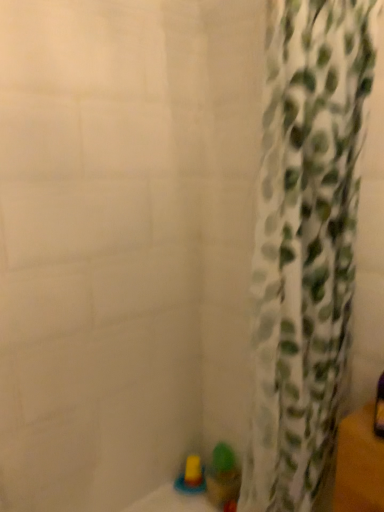
This screenshot has height=512, width=384. Identify the location of translucent yellow toy at lower center, the 2th toy from the right. (191, 477).

You are a GUI agent. You are given a task and a screenshot of the screen. Output one action in this format:
    pyautogui.click(x=<x>, y=<y>)
    Task: Click on the white fabric curtain at right
    
    Given the screenshot: What is the action you would take?
    pyautogui.click(x=305, y=246)

Locate an element on the screen. This screenshot has height=512, width=384. translucent yellow toy at lower center, the 2th toy from the right is located at coordinates (191, 477).

Considering the positions of objects white fabric curtain at right and translucent yellow toy at lower center, which is counted as the 1th toy, starting from the left, in the image provided, who is more to the right, white fabric curtain at right or translucent yellow toy at lower center, which is counted as the 1th toy, starting from the left,?

From the viewer's perspective, white fabric curtain at right appears more on the right side.

Is translucent yellow toy at lower center, the 2th toy from the right, inside white fabric curtain at right?

Actually, translucent yellow toy at lower center, the 2th toy from the right, is outside white fabric curtain at right.

From the image's perspective, which object appears higher, white fabric curtain at right or translucent yellow toy at lower center, which is counted as the 1th toy, starting from the left?

white fabric curtain at right, from the image's perspective.

Based on the photo, is translucent yellow toy at lower center, which is counted as the 1th toy, starting from the left, completely or partially outside of translucent plastic cup at lower center, arranged as the first toy when viewed from the right?

translucent yellow toy at lower center, which is counted as the 1th toy, starting from the left, is positioned outside translucent plastic cup at lower center, arranged as the first toy when viewed from the right.

Would you consider translucent yellow toy at lower center, the 2th toy from the right, to be distant from translucent plastic cup at lower center, arranged as the first toy when viewed from the right?

No, translucent yellow toy at lower center, the 2th toy from the right, is in close proximity to translucent plastic cup at lower center, arranged as the first toy when viewed from the right.

From their relative heights in the image, would you say translucent yellow toy at lower center, which is counted as the 1th toy, starting from the left, is taller or shorter than translucent plastic cup at lower center, arranged as the first toy when viewed from the right?

In the image, translucent yellow toy at lower center, which is counted as the 1th toy, starting from the left, appears to be shorter than translucent plastic cup at lower center, arranged as the first toy when viewed from the right.

Between translucent yellow toy at lower center, the 2th toy from the right, and translucent plastic cup at lower center, the second toy viewed from the left, which one has larger width?

translucent yellow toy at lower center, the 2th toy from the right, is wider.

Is translucent yellow toy at lower center, the 2th toy from the right, smaller than white fabric curtain at right?

Yes.

How many degrees apart are the facing directions of translucent yellow toy at lower center, the 2th toy from the right, and white fabric curtain at right?

There is a 42.5-degree angle between the facing directions of translucent yellow toy at lower center, the 2th toy from the right, and white fabric curtain at right.

Can you confirm if translucent yellow toy at lower center, which is counted as the 1th toy, starting from the left, is taller than white fabric curtain at right?

In fact, translucent yellow toy at lower center, which is counted as the 1th toy, starting from the left, may be shorter than white fabric curtain at right.

Where is `curtain located on the right of translucent yellow toy at lower center, which is counted as the 1th toy, starting from the left`? curtain located on the right of translucent yellow toy at lower center, which is counted as the 1th toy, starting from the left is located at coordinates (305, 246).

Does translucent plastic cup at lower center, arranged as the first toy when viewed from the right, have a smaller size compared to translucent yellow toy at lower center, which is counted as the 1th toy, starting from the left?

Actually, translucent plastic cup at lower center, arranged as the first toy when viewed from the right, might be larger than translucent yellow toy at lower center, which is counted as the 1th toy, starting from the left.

Considering the positions of objects translucent plastic cup at lower center, arranged as the first toy when viewed from the right, and translucent yellow toy at lower center, which is counted as the 1th toy, starting from the left, in the image provided, who is behind, translucent plastic cup at lower center, arranged as the first toy when viewed from the right, or translucent yellow toy at lower center, which is counted as the 1th toy, starting from the left,?

translucent yellow toy at lower center, which is counted as the 1th toy, starting from the left, is further away from the camera.

Is there a large distance between translucent plastic cup at lower center, the second toy viewed from the left, and translucent yellow toy at lower center, the 2th toy from the right?

translucent plastic cup at lower center, the second toy viewed from the left, is near translucent yellow toy at lower center, the 2th toy from the right, not far away.

Does translucent plastic cup at lower center, the second toy viewed from the left, contain translucent yellow toy at lower center, the 2th toy from the right?

Definitely not — translucent yellow toy at lower center, the 2th toy from the right, is not inside translucent plastic cup at lower center, the second toy viewed from the left.

Is translucent plastic cup at lower center, arranged as the first toy when viewed from the right, further to the viewer compared to white fabric curtain at right?

That is True.

Considering the positions of point (234, 475) and point (332, 101), is point (234, 475) closer or farther from the camera than point (332, 101)?

Point (234, 475).

Does translucent plastic cup at lower center, the second toy viewed from the left, turn towards white fabric curtain at right?

No.

Do you think translucent plastic cup at lower center, the second toy viewed from the left, is within white fabric curtain at right, or outside of it?

translucent plastic cup at lower center, the second toy viewed from the left, is not inside white fabric curtain at right, it's outside.

Does white fabric curtain at right contain translucent plastic cup at lower center, the second toy viewed from the left?

No, translucent plastic cup at lower center, the second toy viewed from the left, is located outside of white fabric curtain at right.

Visually, is white fabric curtain at right positioned to the left or to the right of translucent plastic cup at lower center, arranged as the first toy when viewed from the right?

Clearly, white fabric curtain at right is on the right of translucent plastic cup at lower center, arranged as the first toy when viewed from the right, in the image.

Considering the relative sizes of white fabric curtain at right and translucent plastic cup at lower center, the second toy viewed from the left, in the image provided, is white fabric curtain at right taller than translucent plastic cup at lower center, the second toy viewed from the left,?

Correct, white fabric curtain at right is much taller as translucent plastic cup at lower center, the second toy viewed from the left.

How far apart are white fabric curtain at right and translucent plastic cup at lower center, arranged as the first toy when viewed from the right?

white fabric curtain at right and translucent plastic cup at lower center, arranged as the first toy when viewed from the right, are 29.09 inches apart from each other.

Where is `curtain above the translucent yellow toy at lower center, which is counted as the 1th toy, starting from the left (from a real-world perspective)`? The image size is (384, 512). curtain above the translucent yellow toy at lower center, which is counted as the 1th toy, starting from the left (from a real-world perspective) is located at coordinates (305, 246).

In the image, there is a translucent plastic cup at lower center, the second toy viewed from the left. Find the location of `toy below it (from a real-world perspective)`. toy below it (from a real-world perspective) is located at coordinates (191, 477).

Which object lies nearer to the anchor point translucent plastic cup at lower center, the second toy viewed from the left, translucent yellow toy at lower center, which is counted as the 1th toy, starting from the left, or white fabric curtain at right?

translucent yellow toy at lower center, which is counted as the 1th toy, starting from the left.

Considering their positions, is translucent plastic cup at lower center, the second toy viewed from the left, positioned further to translucent yellow toy at lower center, the 2th toy from the right, than white fabric curtain at right?

white fabric curtain at right is positioned further to the anchor translucent yellow toy at lower center, the 2th toy from the right.

Considering their positions, is white fabric curtain at right positioned closer to translucent yellow toy at lower center, the 2th toy from the right, than translucent plastic cup at lower center, the second toy viewed from the left?

Based on the image, translucent plastic cup at lower center, the second toy viewed from the left, appears to be nearer to translucent yellow toy at lower center, the 2th toy from the right.

In the scene shown: Looking at the image, which one is located further to white fabric curtain at right, translucent plastic cup at lower center, arranged as the first toy when viewed from the right, or translucent yellow toy at lower center, which is counted as the 1th toy, starting from the left?

translucent yellow toy at lower center, which is counted as the 1th toy, starting from the left, is positioned further to the anchor white fabric curtain at right.

From the image, which object appears to be farther from white fabric curtain at right, translucent yellow toy at lower center, which is counted as the 1th toy, starting from the left, or translucent plastic cup at lower center, arranged as the first toy when viewed from the right?

Among the two, translucent yellow toy at lower center, which is counted as the 1th toy, starting from the left, is located further to white fabric curtain at right.

Looking at the image, which one is located further to translucent plastic cup at lower center, arranged as the first toy when viewed from the right, white fabric curtain at right or translucent yellow toy at lower center, which is counted as the 1th toy, starting from the left?

white fabric curtain at right.

Locate an element on the screen. The height and width of the screenshot is (512, 384). toy between white fabric curtain at right and translucent yellow toy at lower center, the 2th toy from the right, in the front-back direction is located at coordinates (223, 476).